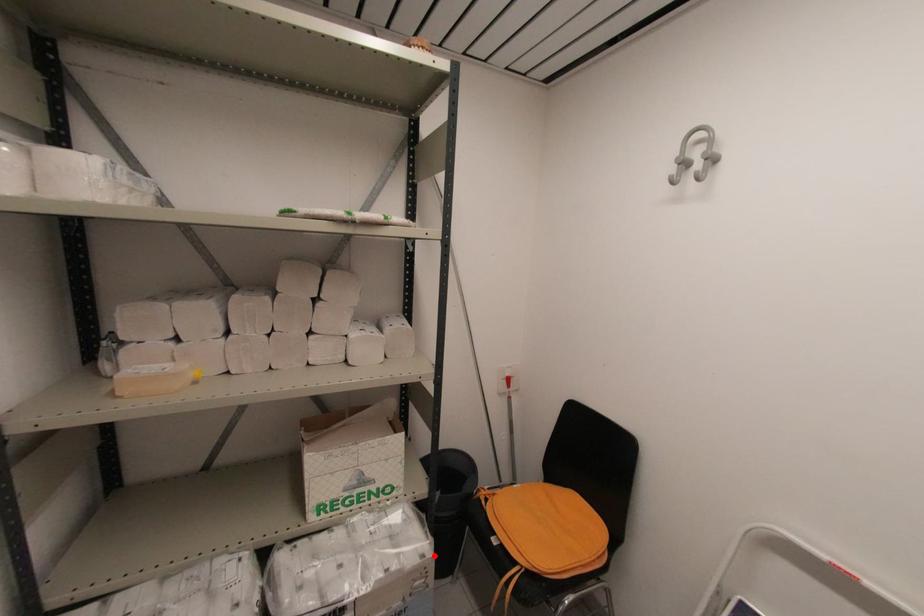
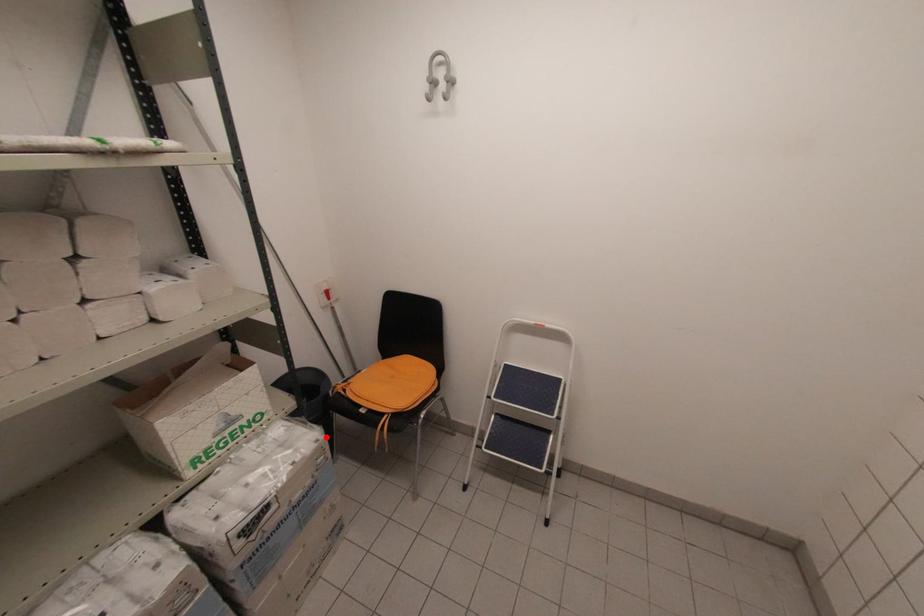
I am providing you with two images of the same scene from different viewpoints. A red point is marked on the first image and another point is marked on the second image. Do the highlighted points in image1 and image2 indicate the same real-world spot?

Yes